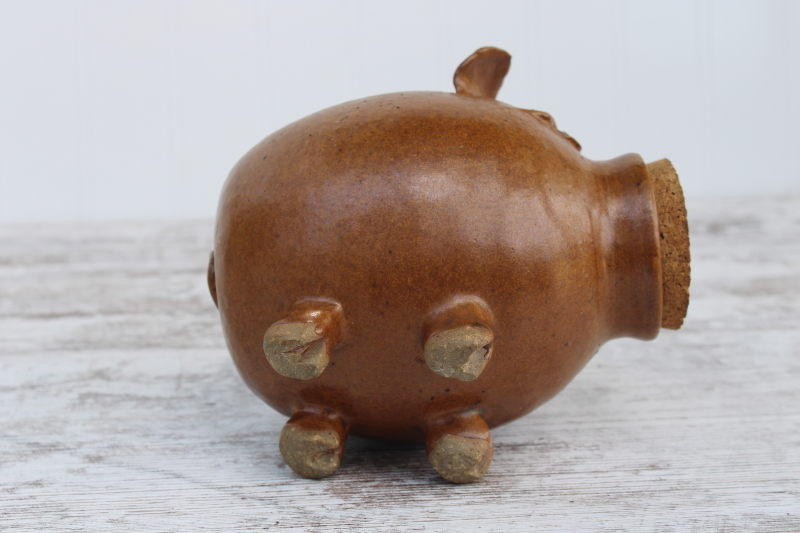
At what (x,y) coordinates should I click in order to perform the action: click on painted wood table. Please return your answer as a coordinate pair (x, y). This screenshot has width=800, height=533. Looking at the image, I should click on (133, 399), (709, 387).